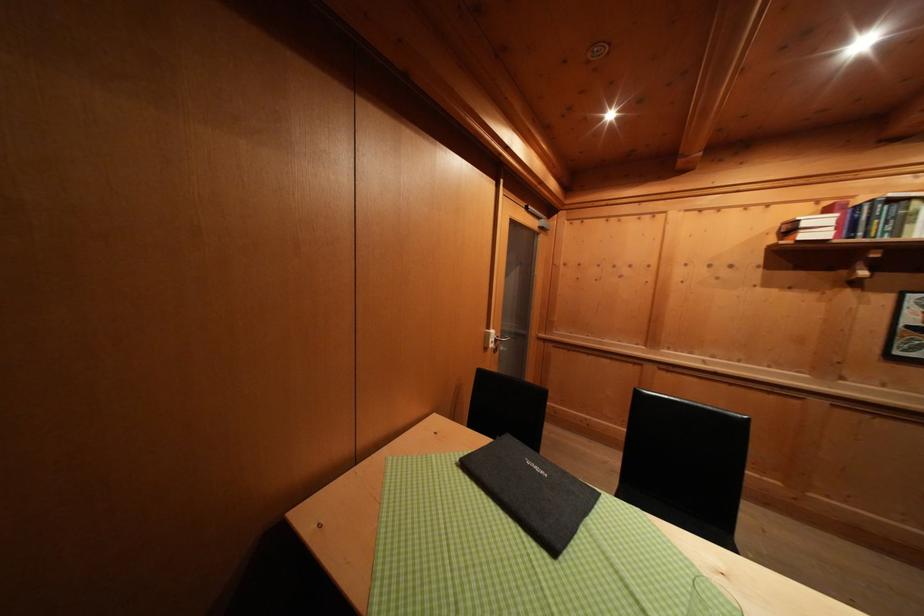
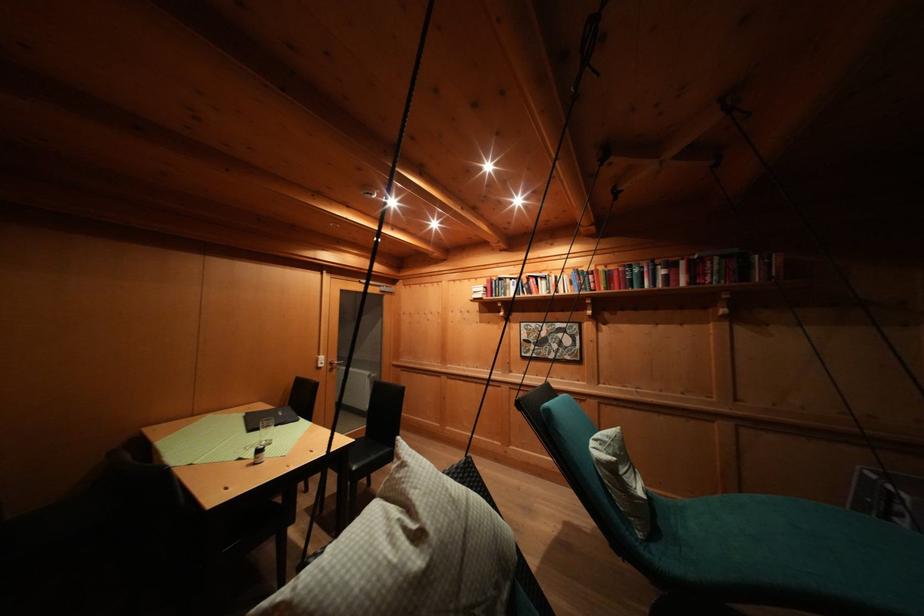
Find the pixel in the second image that matches the point at 493,341 in the first image.

(323, 363)